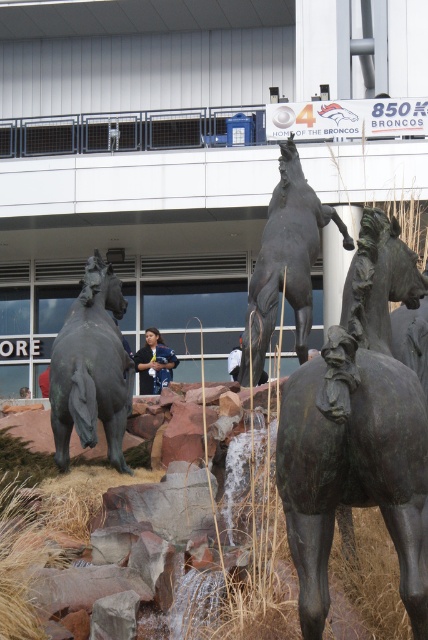
Question: Which point appears farthest from the camera in this image?

Choices:
 (A) (339, 499)
 (B) (88, 314)
 (C) (309, 195)

Answer: (C)

Question: Can you confirm if bronze horse at left is bigger than matte blue shirt at center?

Choices:
 (A) no
 (B) yes

Answer: (B)

Question: Estimate the real-world distances between objects in this image. Which object is closer to the bronze textured horse at center?

Choices:
 (A) bronze horse at upper center
 (B) matte blue shirt at center
 (C) bronze horse at left

Answer: (C)

Question: Does bronze textured horse at center appear on the right side of bronze horse at left?

Choices:
 (A) yes
 (B) no

Answer: (A)

Question: Which point appears farthest from the camera in this image?

Choices:
 (A) (146, 340)
 (B) (119, 284)
 (C) (303, 577)
 (D) (259, 285)

Answer: (A)

Question: Is bronze horse at upper center above matte blue shirt at center?

Choices:
 (A) no
 (B) yes

Answer: (B)